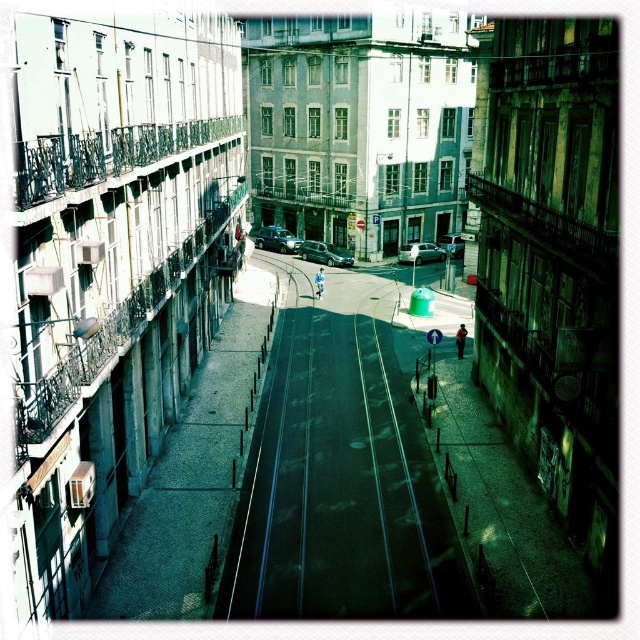
Which is behind, point (332, 253) or point (406, 262)?

The point (406, 262) is behind.

Does point (310, 243) come farther from viewer compared to point (432, 252)?

That is True.

The width and height of the screenshot is (640, 640). Identify the location of shiny silver sedan at center. (324, 253).

Between point (301, 241) and point (454, 234), which one is positioned in front?

Positioned in front is point (301, 241).

Which is below, shiny silver sedan at center or metallic silver car at center?

shiny silver sedan at center is below.

Which is behind, point (312, 253) or point (438, 237)?

The point (438, 237) is more distant.

The height and width of the screenshot is (640, 640). I want to click on shiny silver sedan at center, so pos(324,253).

The height and width of the screenshot is (640, 640). What do you see at coordinates (340, 483) in the screenshot? I see `green rubber track at center` at bounding box center [340, 483].

Looking at this image, which is more to the left, green rubber track at center or metallic silver car at center?

green rubber track at center

Describe the element at coordinates (340, 483) in the screenshot. I see `green rubber track at center` at that location.

The image size is (640, 640). In order to click on green rubber track at center in this screenshot , I will do `click(340, 483)`.